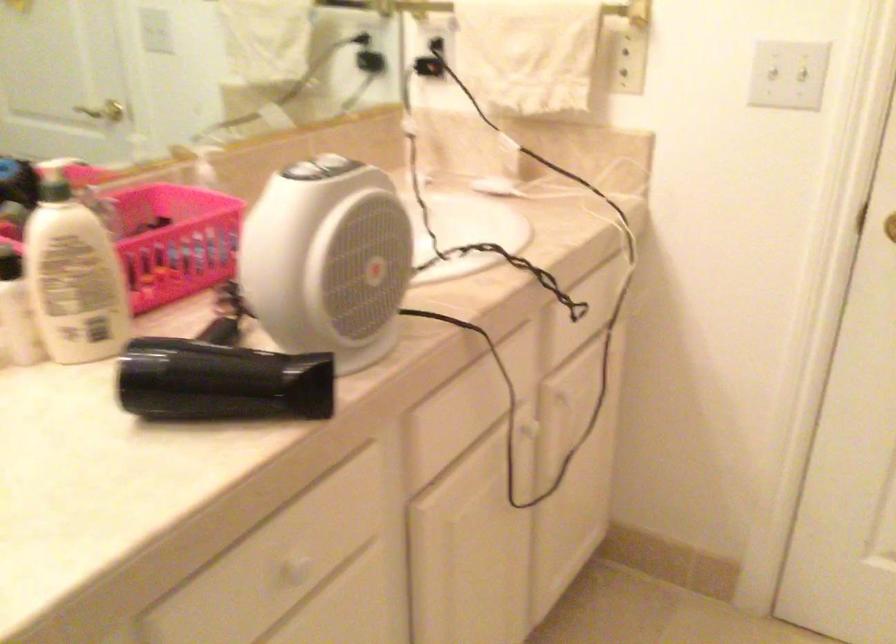
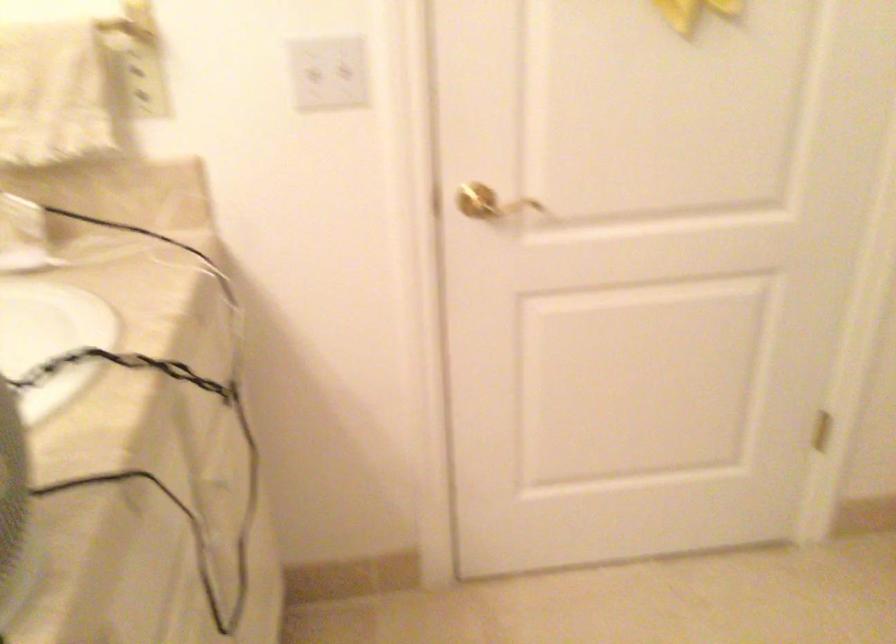
The point at (778, 75) is marked in the first image. Where is the corresponding point in the second image?

(323, 69)